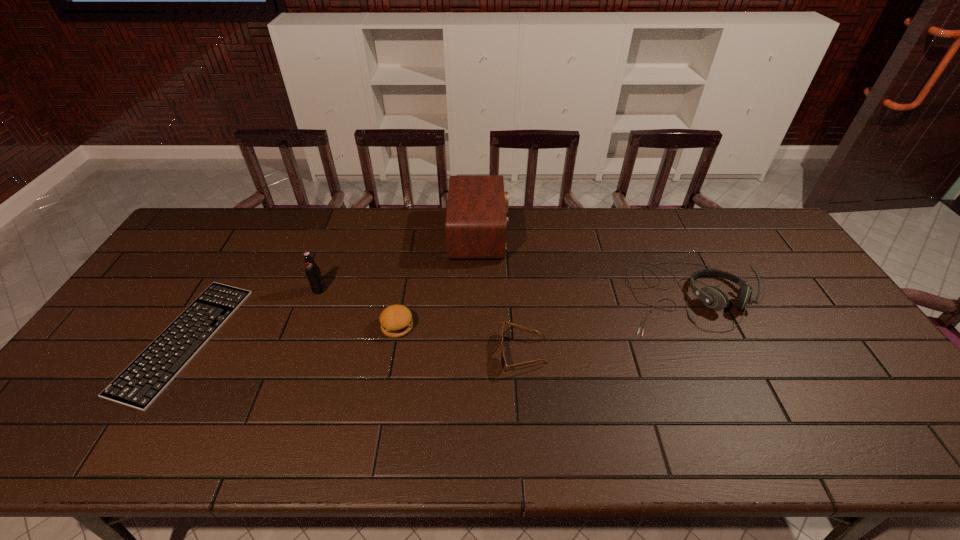
In the image, there is a desktop. At what (x,y) coordinates should I click in order to perform the action: click on vacant space at the near edge. Please return your answer as a coordinate pair (x, y). This screenshot has height=540, width=960. Looking at the image, I should click on (817, 442).

Locate an element on the screen. The width and height of the screenshot is (960, 540). vacant space at the left edge is located at coordinates (110, 378).

Where is `vacant space at the right edge`? vacant space at the right edge is located at coordinates (754, 255).

The height and width of the screenshot is (540, 960). Find the location of `unoccupied position between the hamburger and the pop`. unoccupied position between the hamburger and the pop is located at coordinates (358, 308).

I want to click on free space between the third tallest object and the fourth tallest object, so click(542, 312).

Locate an element on the screen. Image resolution: width=960 pixels, height=540 pixels. free area in between the leftmost object and the pop is located at coordinates (252, 315).

Find the location of a particular element. vacant region between the rightmost object and the computer keyboard is located at coordinates (x=436, y=319).

Image resolution: width=960 pixels, height=540 pixels. Find the location of `free space between the headset and the pop`. free space between the headset and the pop is located at coordinates 503,293.

This screenshot has width=960, height=540. Identify the location of vacant area that lies between the fifth tallest object and the pop. (420, 321).

Where is `vacant space in between the second shortest object and the computer keyboard`? Image resolution: width=960 pixels, height=540 pixels. vacant space in between the second shortest object and the computer keyboard is located at coordinates (353, 347).